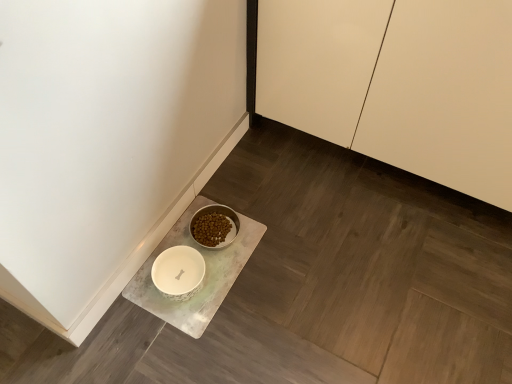
This screenshot has height=384, width=512. Find the location of `vacant area located to the right-hand side of white marble tray at lower left`. vacant area located to the right-hand side of white marble tray at lower left is located at coordinates (297, 264).